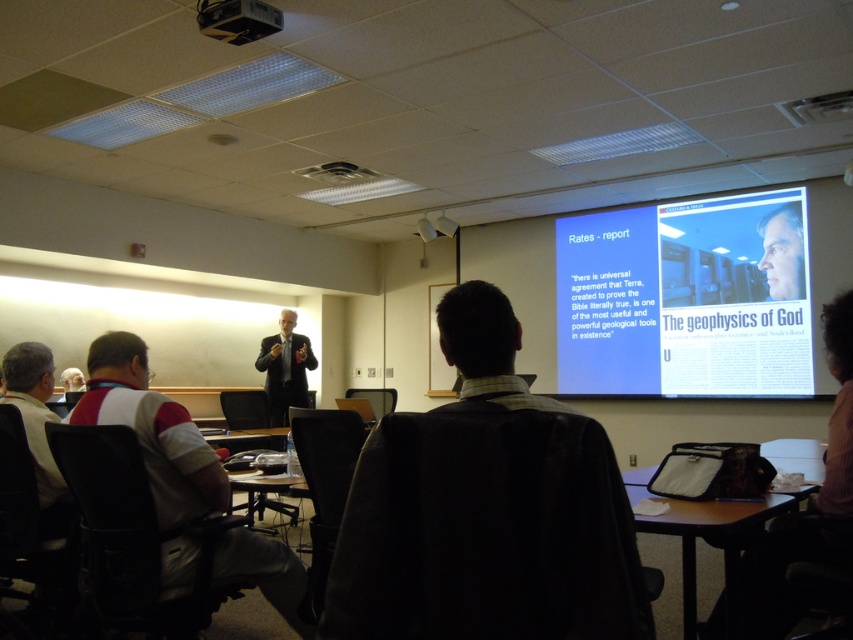
Question: Where is dark brown leather jacket at center located in relation to black plastic projector at upper center in the image?

Choices:
 (A) left
 (B) right

Answer: (B)

Question: Which point is closer to the camera taking this photo?

Choices:
 (A) (280, 364)
 (B) (778, 268)

Answer: (B)

Question: Does gray fabric shirt at left appear over dark suit at center?

Choices:
 (A) yes
 (B) no

Answer: (B)

Question: Does dark brown leather jacket at center lie in front of black plastic projector at upper center?

Choices:
 (A) no
 (B) yes

Answer: (B)

Question: Which object is the closest to the white glossy screen at upper right?

Choices:
 (A) dark brown leather jacket at center
 (B) dark suit at center
 (C) smooth skin face at upper right

Answer: (C)

Question: Estimate the real-world distances between objects in this image. Which object is closer to the black plastic projector at upper center?

Choices:
 (A) dark suit at center
 (B) dark brown leather jacket at center
 (C) white glossy screen at upper right
 (D) black plastic table at lower right

Answer: (B)